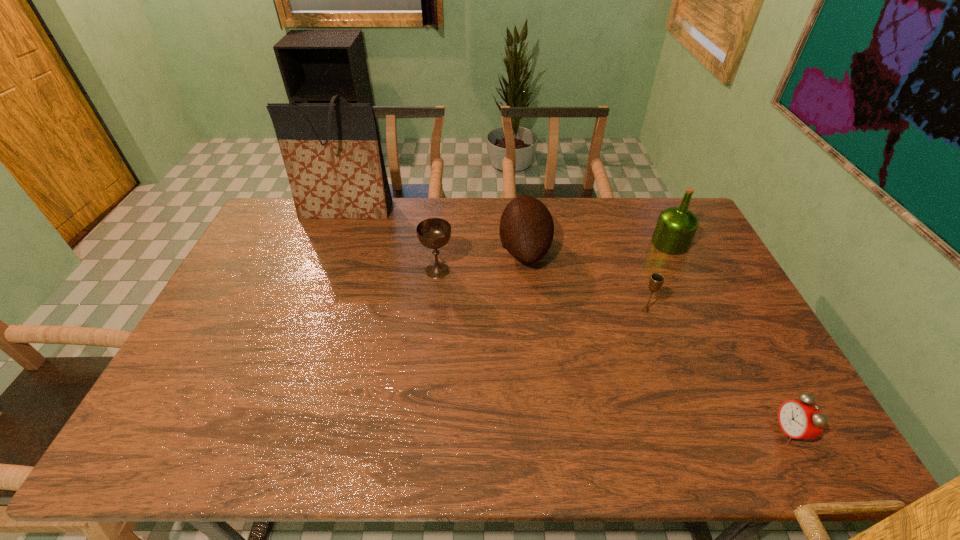
The image size is (960, 540). Identify the location of vacant space that is in between the leftmost object and the fifth object from right to left. pyautogui.click(x=392, y=240).

The image size is (960, 540). I want to click on vacant area between the taller chalice and the olive oil, so click(554, 257).

You are a GUI agent. You are given a task and a screenshot of the screen. Output one action in this format:
    pyautogui.click(x=<x>, y=<y>)
    Task: Click on the free space between the alarm clock and the second shortest object
    The width and height of the screenshot is (960, 540).
    Given the screenshot: What is the action you would take?
    pyautogui.click(x=717, y=371)

Identify the location of free spot between the leftmost object and the shortest object. The width and height of the screenshot is (960, 540). (567, 321).

The height and width of the screenshot is (540, 960). Find the location of `free point between the farther chalice and the nearest object`. free point between the farther chalice and the nearest object is located at coordinates (613, 351).

In order to click on free space between the left chalice and the nearest object in this screenshot , I will do `click(613, 351)`.

At what (x,y) coordinates should I click in order to perform the action: click on object identified as the closest to the second tallest object. Please return your answer as a coordinate pair (x, y). The width and height of the screenshot is (960, 540). Looking at the image, I should click on (656, 280).

Identify the location of object that is the fourth closest to the tallest object. This screenshot has width=960, height=540. (676, 226).

Find the location of a particular element. The height and width of the screenshot is (540, 960). free space that satisfies the following two spatial constraints: 1. on the front-facing side of the tallest object; 2. on the right side of the taller chalice is located at coordinates (324, 271).

You are a GUI agent. You are given a task and a screenshot of the screen. Output one action in this format:
    pyautogui.click(x=<x>, y=<y>)
    Task: Click on the free location that satisfies the following two spatial constraints: 1. on the laces of the fourth object from right to left; 2. on the back side of the second nearest object
    This screenshot has width=960, height=540.
    Given the screenshot: What is the action you would take?
    pyautogui.click(x=532, y=310)